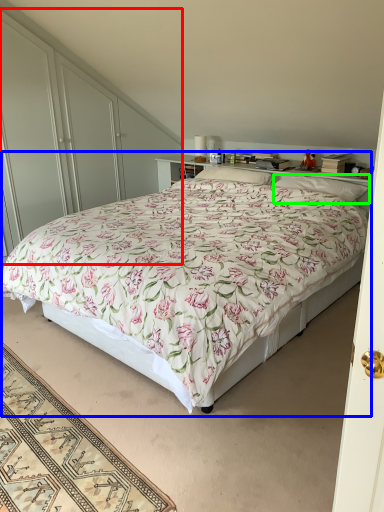
Question: Which object is the closest to the dresser (highlighted by a red box)? Choose among these: bed (highlighted by a blue box) or pillow (highlighted by a green box).

Choices:
 (A) bed
 (B) pillow

Answer: (A)